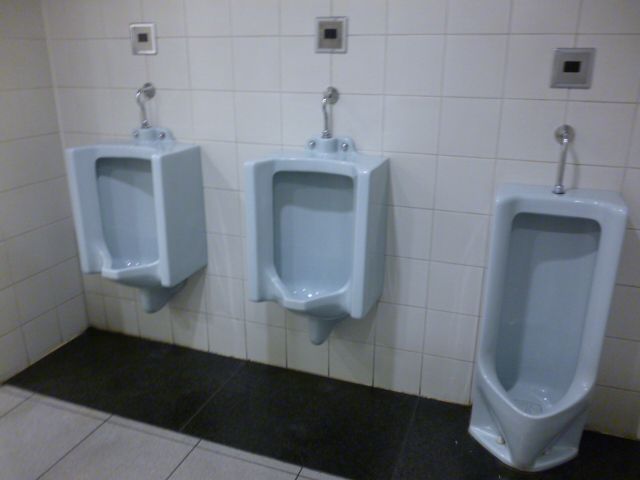
Where is `black rug`? The image size is (640, 480). black rug is located at coordinates (132, 383), (249, 422), (428, 446), (608, 456).